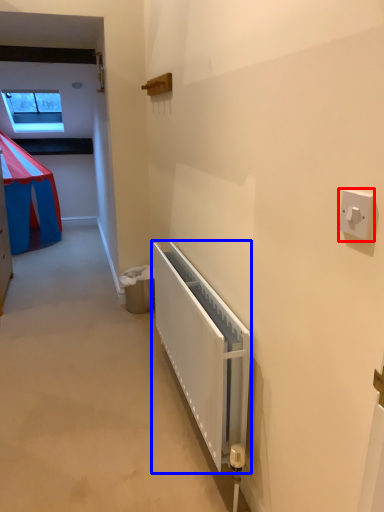
Question: Among these objects, which one is nearest to the camera, light switch (highlighted by a red box) or radiator (highlighted by a blue box)?

Choices:
 (A) light switch
 (B) radiator

Answer: (A)